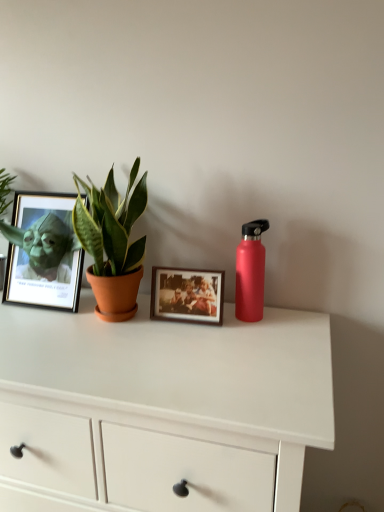
Image resolution: width=384 pixels, height=512 pixels. I want to click on free spot in front of matte black frame at left, which is the 1th picture frame from left to right, so click(44, 332).